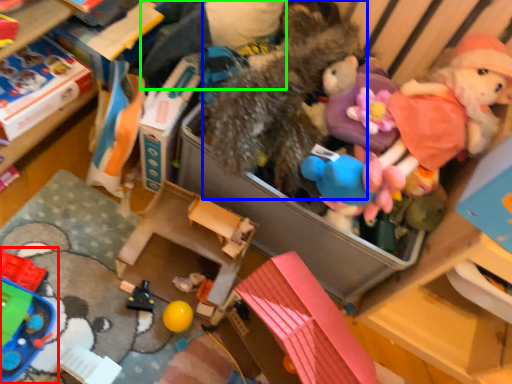
Question: Which object is the closest to the toy (highlighted by a red box)? Choose among these: toy (highlighted by a blue box) or clothing (highlighted by a green box).

Choices:
 (A) toy
 (B) clothing

Answer: (A)